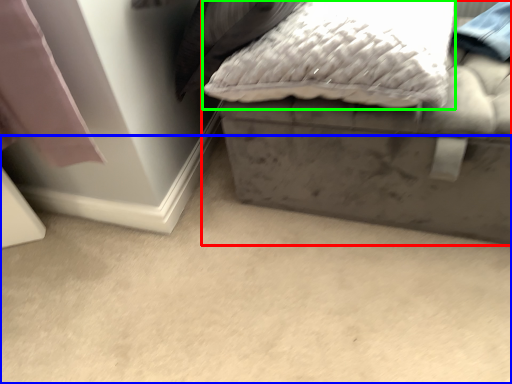
Question: Estimate the real-world distances between objects in this image. Which object is closer to furniture (highlighted by a red box), concrete (highlighted by a blue box) or pillow (highlighted by a green box)?

Choices:
 (A) concrete
 (B) pillow

Answer: (B)